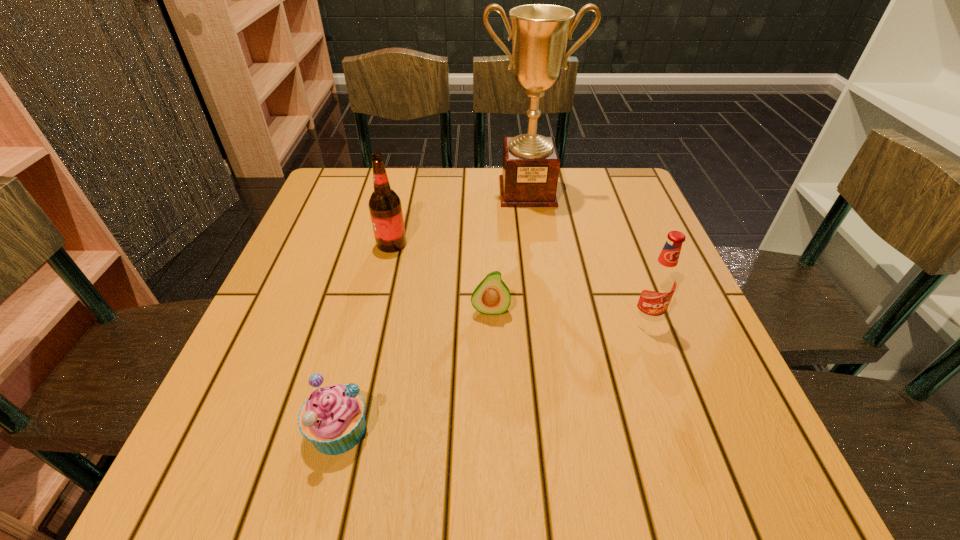
In the image, there is a desktop. Identify the location of vacant area at the right edge. (659, 399).

Image resolution: width=960 pixels, height=540 pixels. I want to click on vacant region at the far left corner of the desktop, so click(325, 217).

The width and height of the screenshot is (960, 540). I want to click on vacant space at the far right corner of the desktop, so click(587, 212).

In order to click on free area in between the muffin and the right root beer in this screenshot , I will do `click(492, 374)`.

Identify the location of vacant space that's between the muffin and the tallest object. This screenshot has height=540, width=960. (433, 310).

This screenshot has width=960, height=540. In order to click on free area in between the avocado and the rightmost object in this screenshot , I will do `click(568, 315)`.

Where is `vacant area that lies between the nearest object and the left root beer`? vacant area that lies between the nearest object and the left root beer is located at coordinates coord(365,336).

Find the location of a particular element. Image resolution: width=960 pixels, height=540 pixels. vacant point located between the trophy cup and the nearest object is located at coordinates (433, 310).

The height and width of the screenshot is (540, 960). I want to click on free area in between the avocado and the left root beer, so click(441, 277).

Identify the location of unoccupied position between the right root beer and the farther root beer. (518, 282).